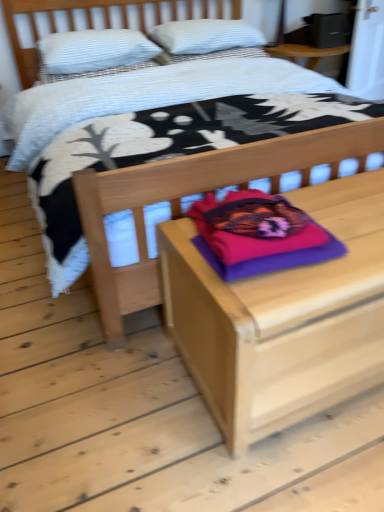
Question: From the image's perspective, is wooden nightstand at center positioned above or below white textured pillow at upper left, which is the second pillow from top to bottom?

Choices:
 (A) below
 (B) above

Answer: (A)

Question: Is wooden nightstand at center situated inside white textured pillow at upper left, acting as the 2th pillow starting from the back, or outside?

Choices:
 (A) inside
 (B) outside

Answer: (B)

Question: Which is farther from the purple soft pillow at center, the 3th pillow in the back-to-front sequence?

Choices:
 (A) white textured pillow at upper center, marked as the third pillow in a front-to-back arrangement
 (B) wooden nightstand at center
 (C) wooden bed at center
 (D) white textured pillow at upper left, the second pillow in the bottom-to-top sequence

Answer: (C)

Question: Which object is the closest to the wooden nightstand at center?

Choices:
 (A) white textured pillow at upper left, which is the second pillow from top to bottom
 (B) white textured pillow at upper center, arranged as the 3th pillow when ordered from the bottom
 (C) wooden bed at center
 (D) purple soft pillow at center, which ranks as the third pillow in top-to-bottom order

Answer: (D)